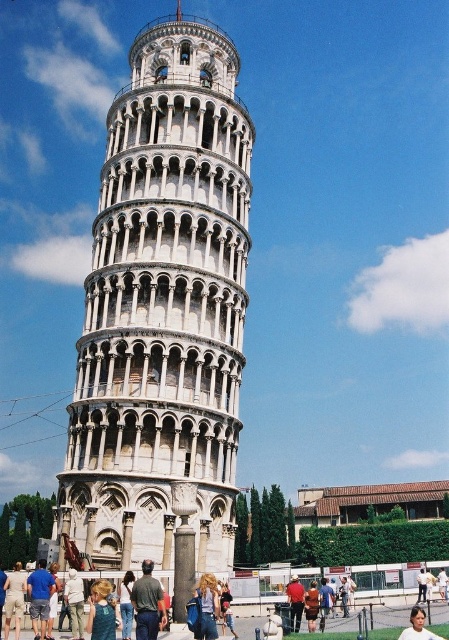
You are a photographer planning to capture a photo of the Leaning Tower of Pisa. You notice two tourists in the foreground wearing a light brown fabric pants at lower center and a red shirt at center. Based on their sizes, which clothing item would appear more prominent in your photo?

The light brown fabric pants at lower center appears larger in size than the red shirt at center, so it would be more prominent in the photo.

You are a tourist visiting the Leaning Tower of Pisa and want to take a photo with the white marble tower at center. You are standing near the denim jeans at center. Based on their sizes, will the tower block your view in the photo?

The white marble tower at center is larger than the denim jeans at center, so when taking a photo from your position near the denim jeans at center, the tower will likely block most of your view since it is significantly bigger in size.